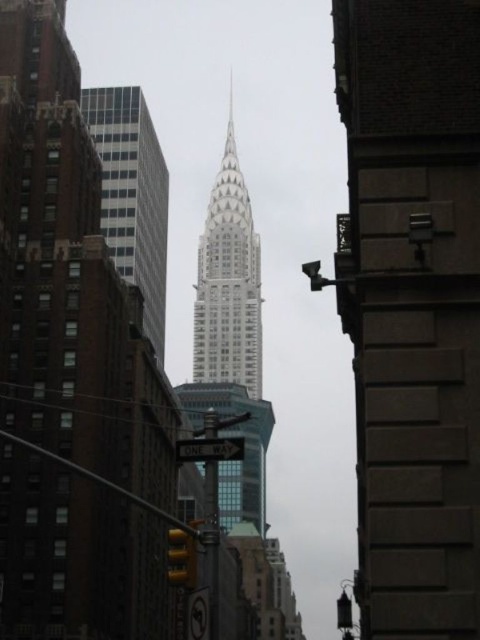
Who is shorter, white glass skyscraper at upper center or yellow matte traffic light at lower center?

With less height is yellow matte traffic light at lower center.

Does white glass skyscraper at upper center appear under yellow matte traffic light at lower center?

No.

Who is more forward, (x=128, y=246) or (x=181, y=544)?

Point (x=181, y=544) is in front.

Where is `white glass skyscraper at upper center`? white glass skyscraper at upper center is located at coordinates (132, 196).

Does white glass skyscraper at upper center have a smaller size compared to glassy steel skyscraper at center?

Yes, white glass skyscraper at upper center is smaller than glassy steel skyscraper at center.

Is white glass skyscraper at upper center to the right of glassy steel skyscraper at center from the viewer's perspective?

In fact, white glass skyscraper at upper center is to the left of glassy steel skyscraper at center.

Between point (105, 102) and point (206, 284), which one is positioned behind?

Point (206, 284)

The width and height of the screenshot is (480, 640). What are the coordinates of `white glass skyscraper at upper center` in the screenshot? It's located at (132, 196).

Does smooth stone tower at center appear over yellow matte traffic light at lower center?

Yes, smooth stone tower at center is above yellow matte traffic light at lower center.

Is point (352, 301) less distant than point (167, 563)?

That is True.

Which is in front, point (391, 13) or point (183, 550)?

Point (391, 13)

Find the location of a particular element. smooth stone tower at center is located at coordinates (414, 307).